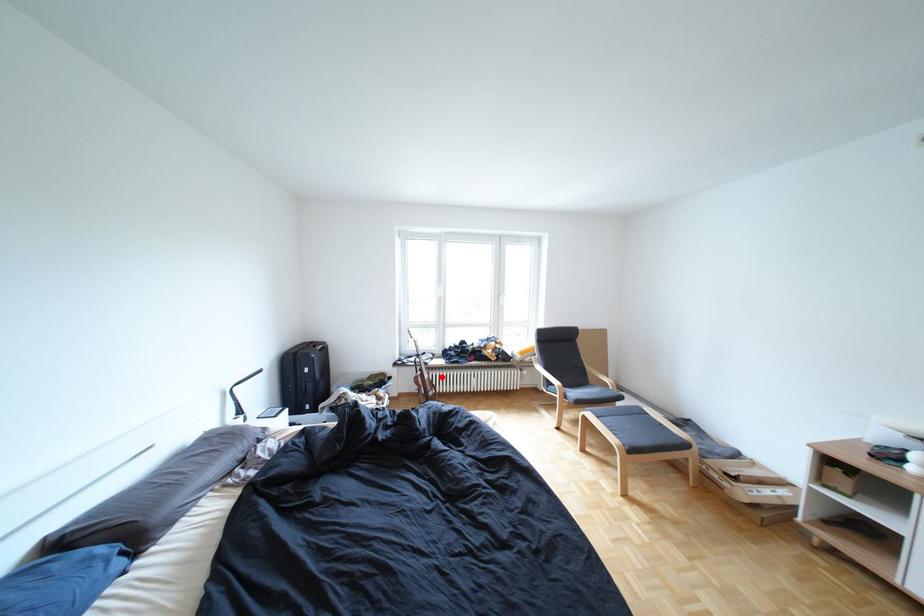
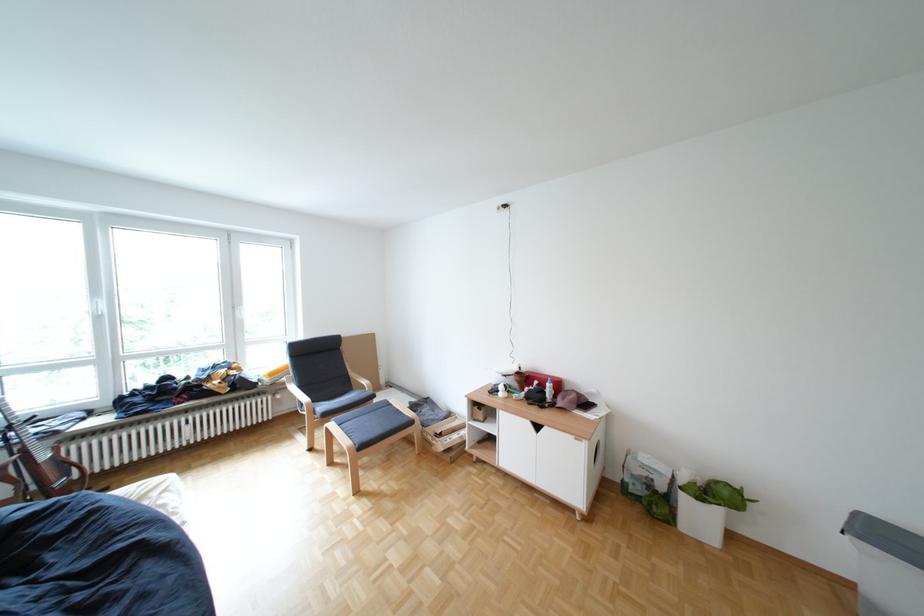
In the second image, find the point that corresponds to the highlighted location in the first image.

(59, 458)